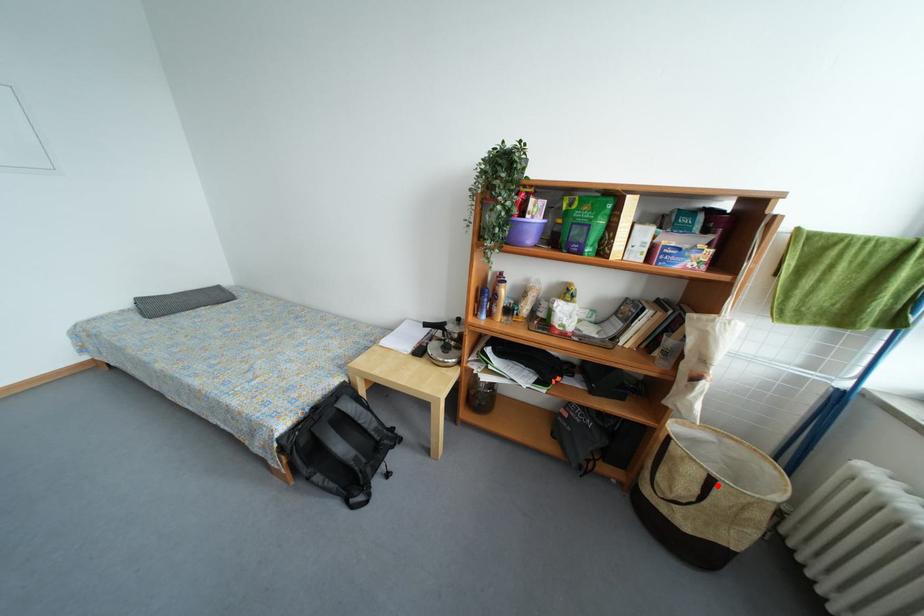
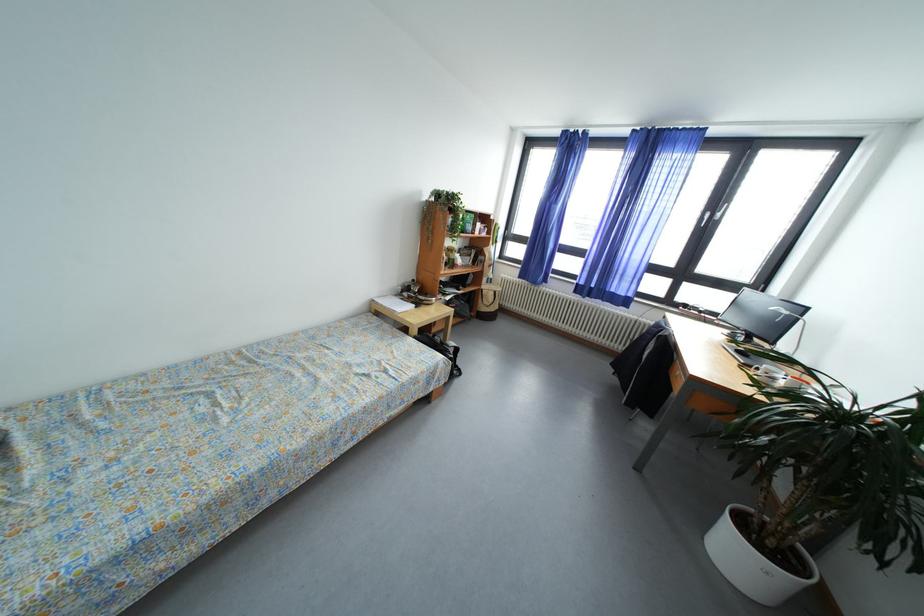
Question: I am providing you with two images of the same scene from different viewpoints. Image1 has a red point marked. In image2, the corresponding 3D location appears at what relative position? Reply with the corresponding letter.

Choices:
 (A) Closer
 (B) Farther

Answer: (A)